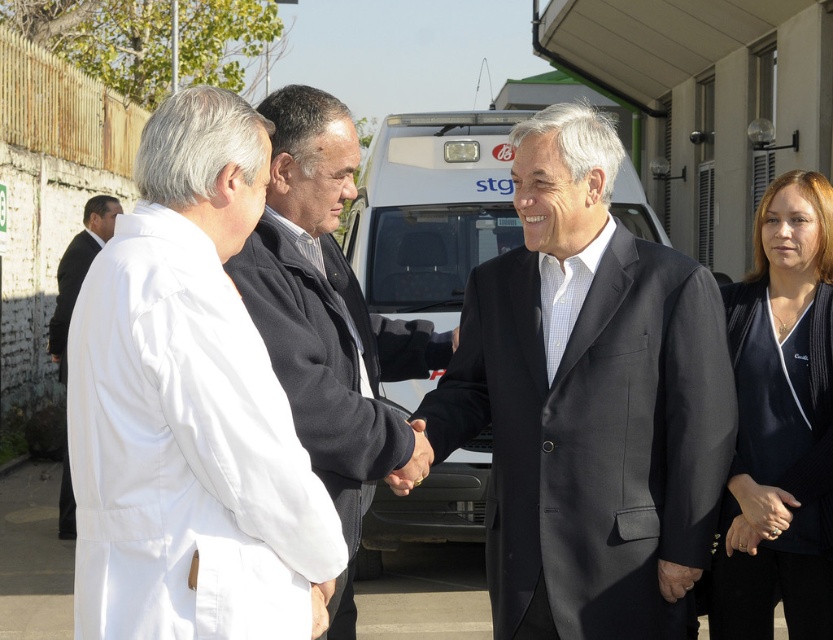
Looking at this image, you are a fashion designer observing the image. You need to determine the spatial relationship between the dark blue textured blazer at right and the dark gray sweater at center. Which one is positioned lower in the image?

The dark blue textured blazer at right is positioned lower than the dark gray sweater at center because it is below it.

You are standing in the outdoor scene and want to place a small flag at the point closer to you between point (213,529) and point (757,365). Which point should you choose?

You should choose point (213,529) because it is closer to the camera than point (757,365).

You are a photographer setting up a shoot for a magazine cover. You have two outfits to choose from for the main subject, the matte black suit at center and the dark gray sweater at center. The magazine requires the outfit to be wider than the other. Which one should you select?

The matte black suit at center has a greater width than the dark gray sweater at center, so you should select the matte black suit at center for the magazine cover as it meets the requirement of being wider.